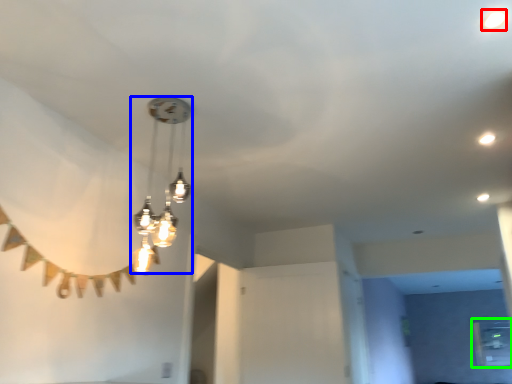
Question: Which object is positioned farthest from droplight (highlighted by a red box)? Select from lamp (highlighted by a blue box) and window (highlighted by a green box).

Choices:
 (A) lamp
 (B) window

Answer: (B)